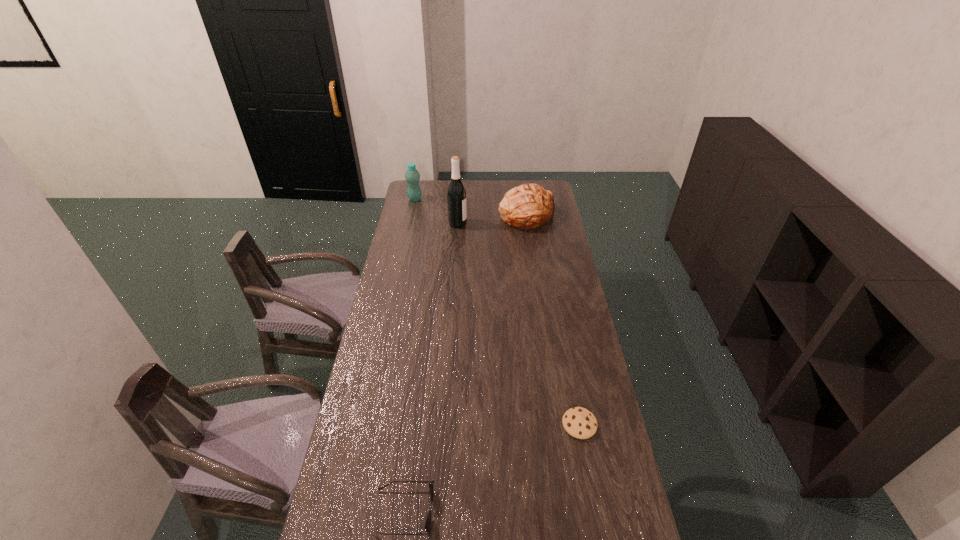
Find the location of `object situated at the far right corner`. object situated at the far right corner is located at coordinates (529, 206).

In the image, there is a desktop. Find the location of `vacant space at the far edge`. vacant space at the far edge is located at coordinates (510, 181).

The width and height of the screenshot is (960, 540). I want to click on vacant region at the left edge of the desktop, so click(382, 482).

The image size is (960, 540). In order to click on free space at the right edge in this screenshot , I will do `click(568, 254)`.

Where is `vacant space at the far right corner of the desktop`? vacant space at the far right corner of the desktop is located at coordinates point(550,190).

The width and height of the screenshot is (960, 540). Identify the location of free space between the water bottle and the second shortest object. (409, 355).

You are a GUI agent. You are given a task and a screenshot of the screen. Output one action in this format:
    pyautogui.click(x=<x>, y=<y>)
    Task: Click on the vacant region between the second nearest object and the third tallest object
    The height and width of the screenshot is (540, 960).
    Given the screenshot: What is the action you would take?
    pyautogui.click(x=554, y=320)

Where is `empty location between the fourth shortest object and the wine bottle`? This screenshot has width=960, height=540. empty location between the fourth shortest object and the wine bottle is located at coordinates (437, 211).

You are a GUI agent. You are given a task and a screenshot of the screen. Output one action in this format:
    pyautogui.click(x=<x>, y=<y>)
    Task: Click on the free space between the fourth farthest object and the water bottle
    
    Given the screenshot: What is the action you would take?
    pyautogui.click(x=497, y=312)

Where is `free space between the shortest object and the sunglasses`? The image size is (960, 540). free space between the shortest object and the sunglasses is located at coordinates (492, 468).